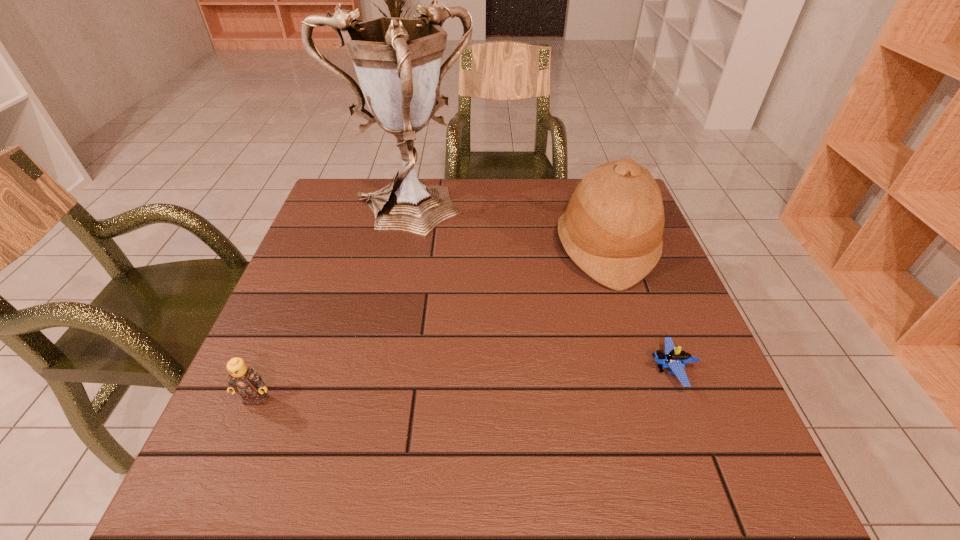
You are a GUI agent. You are given a task and a screenshot of the screen. Output one action in this format:
    pyautogui.click(x=<x>, y=<y>)
    Task: Click on the vacant space that satisfies the following two spatial constraints: 1. on the front-facing side of the shortest object; 2. in front of the taller Lego
    This screenshot has height=540, width=960.
    Given the screenshot: What is the action you would take?
    pyautogui.click(x=682, y=399)

This screenshot has width=960, height=540. Identify the location of vacant space that satisfies the following two spatial constraints: 1. on the front-facing side of the hat; 2. in front of the left Lego. (654, 399).